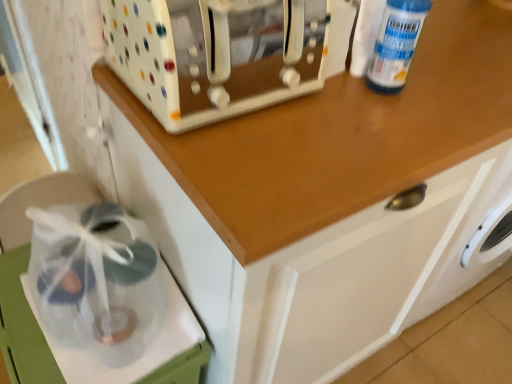
Question: Does clear plastic bag at lower left appear on the left side of white glossy toaster at upper center?

Choices:
 (A) no
 (B) yes

Answer: (B)

Question: From a real-world perspective, is clear plastic bag at lower left positioned under white glossy toaster at upper center based on gravity?

Choices:
 (A) no
 (B) yes

Answer: (B)

Question: Is clear plastic bag at lower left directly adjacent to white glossy toaster at upper center?

Choices:
 (A) yes
 (B) no

Answer: (B)

Question: Is clear plastic bag at lower left smaller than white glossy toaster at upper center?

Choices:
 (A) no
 (B) yes

Answer: (B)

Question: Can you confirm if clear plastic bag at lower left is thinner than white glossy toaster at upper center?

Choices:
 (A) yes
 (B) no

Answer: (B)

Question: Is there a large distance between clear plastic bag at lower left and white glossy toaster at upper center?

Choices:
 (A) yes
 (B) no

Answer: (B)

Question: Can you confirm if clear plastic bottle at upper right is taller than white glossy toaster at upper center?

Choices:
 (A) no
 (B) yes

Answer: (B)

Question: Can you confirm if clear plastic bottle at upper right is positioned to the right of white glossy toaster at upper center?

Choices:
 (A) yes
 (B) no

Answer: (A)

Question: From a real-world perspective, is clear plastic bottle at upper right physically below white glossy toaster at upper center?

Choices:
 (A) yes
 (B) no

Answer: (B)

Question: Are clear plastic bottle at upper right and white glossy toaster at upper center making contact?

Choices:
 (A) yes
 (B) no

Answer: (B)

Question: Does clear plastic bottle at upper right turn towards white glossy toaster at upper center?

Choices:
 (A) yes
 (B) no

Answer: (B)

Question: Is clear plastic bottle at upper right outside white glossy toaster at upper center?

Choices:
 (A) yes
 (B) no

Answer: (A)

Question: Considering the relative sizes of white glossy toaster at upper center and clear plastic bag at lower left in the image provided, is white glossy toaster at upper center wider than clear plastic bag at lower left?

Choices:
 (A) yes
 (B) no

Answer: (B)